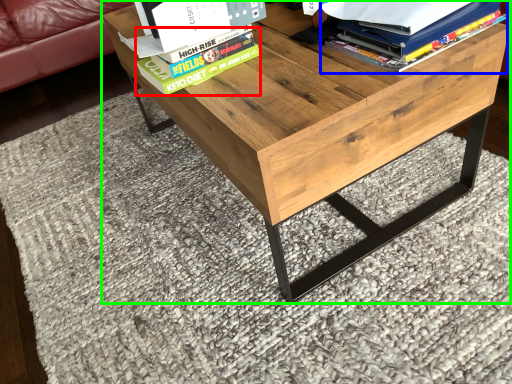
Question: Estimate the real-world distances between objects in this image. Which object is closer to paperback book (highlighted by a red box), book (highlighted by a blue box) or table (highlighted by a green box)?

Choices:
 (A) book
 (B) table

Answer: (B)